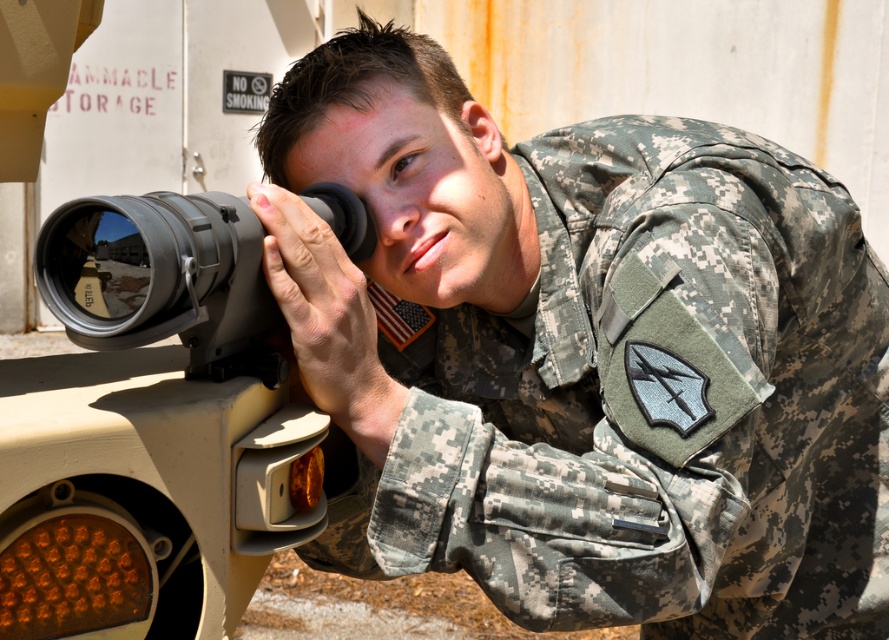
You are a military inspector checking the equipment setup. The camouflage uniform at center and the matte black scope at center are both in your line of sight. Which object is wider?

The camouflage uniform at center is wider than the matte black scope at center, as stated in the description that the camouflage uniform at center surpasses the scope in width.

You are a military equipment inspector tasked with ensuring proper equipment sizing. You observe the camouflage uniform at center and the matte black scope at center. Based on their sizes, can the scope be comfortably attached to the uniform?

The camouflage uniform at center is larger than the matte black scope at center, so the scope can be comfortably attached to the uniform.